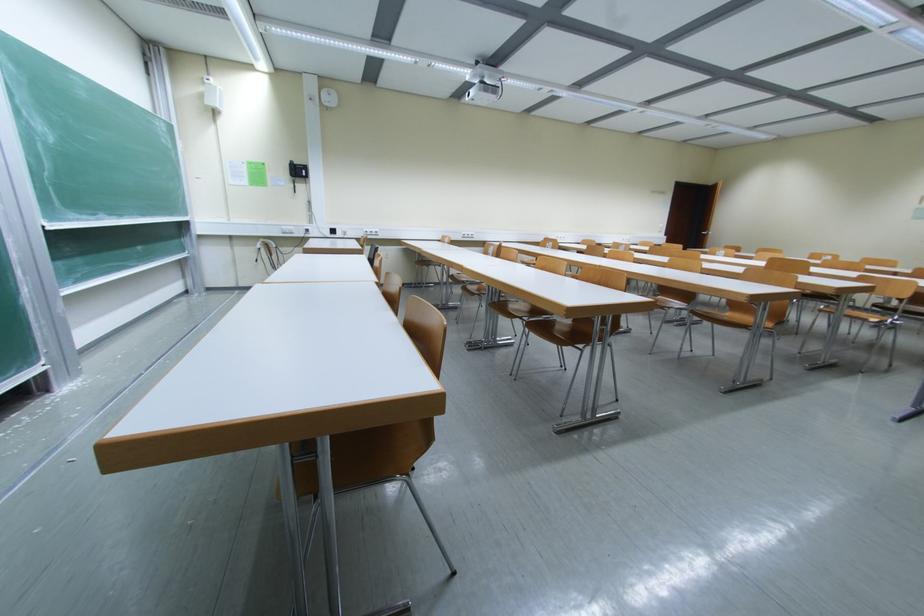
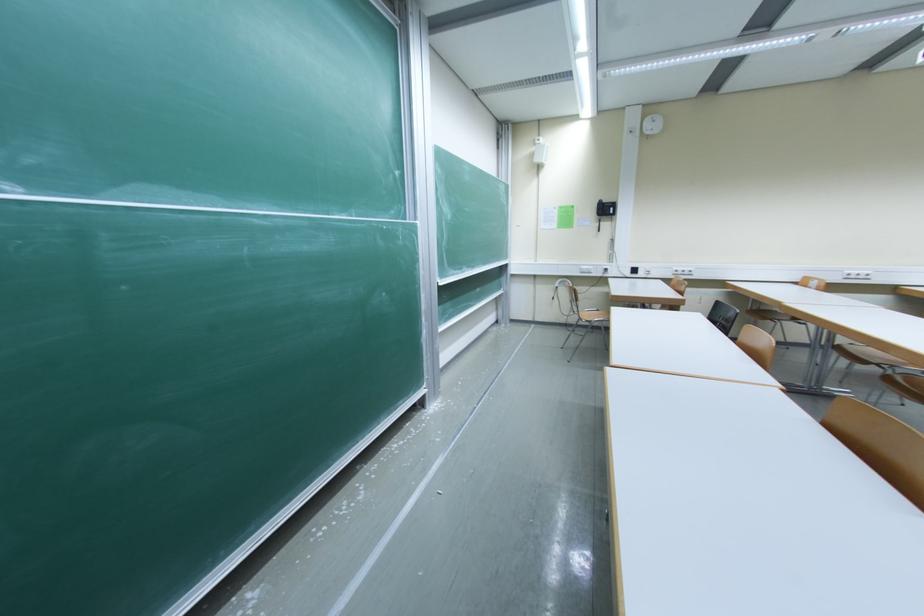
Question: How did the camera likely rotate?

Choices:
 (A) Left
 (B) Right
 (C) Up
 (D) Down

Answer: (A)